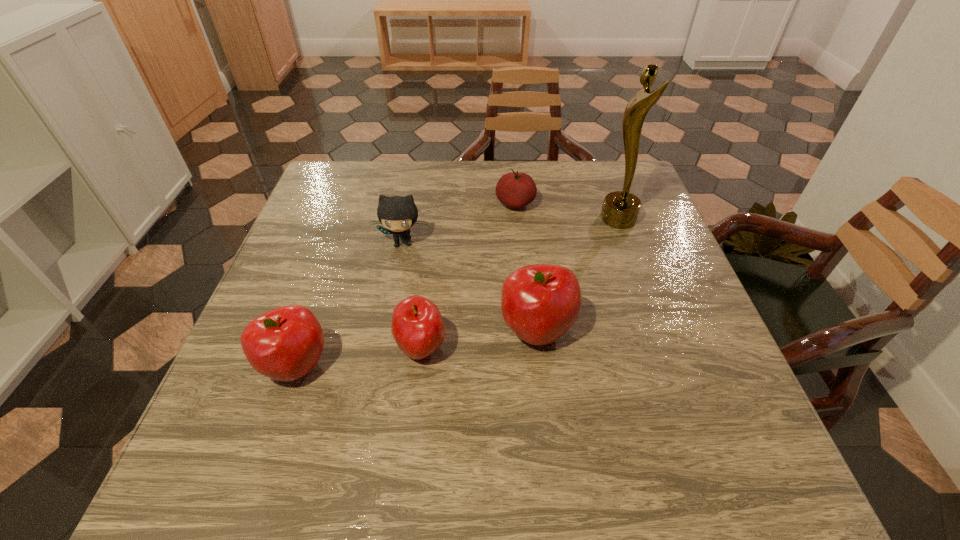
Find the location of a particular element. the second closest apple relative to the kitten is located at coordinates (539, 303).

Find the location of `vacant area in the image that satisfies the following two spatial constraints: 1. on the front-facing side of the kitten; 2. on the left side of the shortest apple`. vacant area in the image that satisfies the following two spatial constraints: 1. on the front-facing side of the kitten; 2. on the left side of the shortest apple is located at coordinates (382, 348).